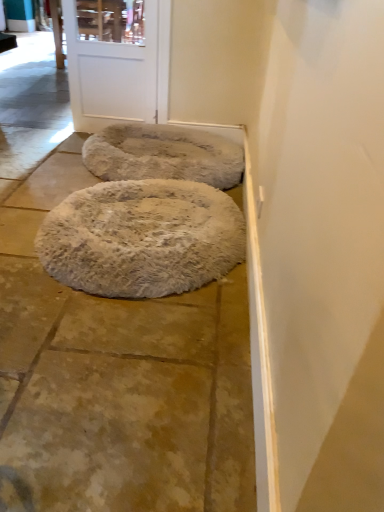
At what (x,y) coordinates should I click in order to perform the action: click on white fluffy rug at center. Please return your answer as a coordinate pair (x, y). The height and width of the screenshot is (512, 384). Looking at the image, I should click on (119, 379).

What is the approximate width of white fluffy rug at center?

It is 8.79 feet.

At what (x,y) coordinates should I click in order to perform the action: click on white fluffy dog bed at center, the second dog bed viewed from the back. Please return your answer as a coordinate pair (x, y). This screenshot has width=384, height=512. Looking at the image, I should click on click(x=142, y=238).

Considering the relative sizes of fuzzy beige dog bed at center, the 2th dog bed positioned from the front, and white fluffy dog bed at center, the second dog bed viewed from the back, in the image provided, is fuzzy beige dog bed at center, the 2th dog bed positioned from the front, thinner than white fluffy dog bed at center, the second dog bed viewed from the back,?

Incorrect, the width of fuzzy beige dog bed at center, the 2th dog bed positioned from the front, is not less than that of white fluffy dog bed at center, the second dog bed viewed from the back.

Which object is further away from the camera taking this photo, fuzzy beige dog bed at center, placed as the 1th dog bed when sorted from back to front, or white fluffy dog bed at center, which appears as the 1th dog bed when viewed from the front?

fuzzy beige dog bed at center, placed as the 1th dog bed when sorted from back to front.

In the image, is fuzzy beige dog bed at center, the 2th dog bed positioned from the front, on the left side or the right side of white fluffy dog bed at center, the second dog bed viewed from the back?

From the image, it's evident that fuzzy beige dog bed at center, the 2th dog bed positioned from the front, is to the right of white fluffy dog bed at center, the second dog bed viewed from the back.

Which of these two, fuzzy beige dog bed at center, the 2th dog bed positioned from the front, or white fluffy dog bed at center, which appears as the 1th dog bed when viewed from the front, is bigger?

Bigger between the two is fuzzy beige dog bed at center, the 2th dog bed positioned from the front.

From the picture: Is fuzzy beige dog bed at center, the 2th dog bed positioned from the front, positioned beyond the bounds of white fluffy rug at center?

Yes, fuzzy beige dog bed at center, the 2th dog bed positioned from the front, is not within white fluffy rug at center.

Is fuzzy beige dog bed at center, placed as the 1th dog bed when sorted from back to front, looking in the opposite direction of white fluffy rug at center?

No, fuzzy beige dog bed at center, placed as the 1th dog bed when sorted from back to front, is not facing the opposite direction of white fluffy rug at center.

Considering the relative sizes of fuzzy beige dog bed at center, the 2th dog bed positioned from the front, and white fluffy rug at center in the image provided, is fuzzy beige dog bed at center, the 2th dog bed positioned from the front, smaller than white fluffy rug at center?

Indeed, fuzzy beige dog bed at center, the 2th dog bed positioned from the front, has a smaller size compared to white fluffy rug at center.

Considering the relative positions of fuzzy beige dog bed at center, placed as the 1th dog bed when sorted from back to front, and white fluffy rug at center in the image provided, is fuzzy beige dog bed at center, placed as the 1th dog bed when sorted from back to front, in front of white fluffy rug at center?

That is False.

Could you tell me if white fluffy rug at center is turned towards white fluffy dog bed at center, the second dog bed viewed from the back?

No, white fluffy rug at center is not facing towards white fluffy dog bed at center, the second dog bed viewed from the back.

Is white fluffy rug at center not close to white fluffy dog bed at center, the second dog bed viewed from the back?

That's not correct — white fluffy rug at center is a little close to white fluffy dog bed at center, the second dog bed viewed from the back.

Is white fluffy rug at center positioned beyond the bounds of white fluffy dog bed at center, which appears as the 1th dog bed when viewed from the front?

Yes.

Between white fluffy rug at center and white fluffy dog bed at center, which appears as the 1th dog bed when viewed from the front, which one has smaller width?

Thinner between the two is white fluffy dog bed at center, which appears as the 1th dog bed when viewed from the front.

Could you measure the distance between white fluffy dog bed at center, which appears as the 1th dog bed when viewed from the front, and white matte door at upper center?

4.20 feet.

Is white fluffy dog bed at center, which appears as the 1th dog bed when viewed from the front, oriented away from white matte door at upper center?

No, white fluffy dog bed at center, which appears as the 1th dog bed when viewed from the front,'s orientation is not away from white matte door at upper center.

Which object is positioned more to the right, white fluffy dog bed at center, the second dog bed viewed from the back, or white matte door at upper center?

white fluffy dog bed at center, the second dog bed viewed from the back.

Is white fluffy dog bed at center, the second dog bed viewed from the back, directly adjacent to white matte door at upper center?

No.

How many degrees apart are the facing directions of white fluffy dog bed at center, the second dog bed viewed from the back, and white fluffy rug at center?

There is a 90.6-degree angle between the facing directions of white fluffy dog bed at center, the second dog bed viewed from the back, and white fluffy rug at center.

Is white fluffy dog bed at center, which appears as the 1th dog bed when viewed from the front, closer to the viewer compared to white fluffy rug at center?

That is False.

Is white fluffy dog bed at center, which appears as the 1th dog bed when viewed from the front, turned away from white fluffy rug at center?

That's not correct — white fluffy dog bed at center, which appears as the 1th dog bed when viewed from the front, is not looking away from white fluffy rug at center.

Is white fluffy dog bed at center, the second dog bed viewed from the back, directly adjacent to white fluffy rug at center?

white fluffy dog bed at center, the second dog bed viewed from the back, and white fluffy rug at center are not in contact.

Is white fluffy rug at center further to camera compared to white matte door at upper center?

No, the depth of white fluffy rug at center is less than that of white matte door at upper center.

Find the location of a particular element. pavement below the white matte door at upper center (from the image's perspective) is located at coordinates (119, 379).

Considering the sizes of objects white fluffy rug at center and white matte door at upper center in the image provided, who is shorter, white fluffy rug at center or white matte door at upper center?

white fluffy rug at center.

In the scene shown: Which object is wider, white fluffy rug at center or white matte door at upper center?

Wider between the two is white fluffy rug at center.

From the image's perspective, is white fluffy rug at center above fuzzy beige dog bed at center, placed as the 1th dog bed when sorted from back to front?

No.

Which is in front, point (177, 316) or point (166, 146)?

The point (177, 316) is in front.

Which of these two, white fluffy rug at center or fuzzy beige dog bed at center, placed as the 1th dog bed when sorted from back to front, is wider?

With larger width is white fluffy rug at center.

This screenshot has width=384, height=512. What are the coordinates of `pavement in front of the fuzzy beige dog bed at center, the 2th dog bed positioned from the front` in the screenshot? It's located at pos(119,379).

What are the coordinates of `dog bed on the left side of fuzzy beige dog bed at center, placed as the 1th dog bed when sorted from back to front` in the screenshot? It's located at tap(142, 238).

From the image's perspective, which dog bed is the 2nd one above the white fluffy rug at center? Please provide its 2D coordinates.

[(163, 155)]

Based on their spatial positions, is white fluffy dog bed at center, which appears as the 1th dog bed when viewed from the front, or white fluffy rug at center further from white matte door at upper center?

The object further to white matte door at upper center is white fluffy rug at center.

Considering their positions, is white fluffy dog bed at center, the second dog bed viewed from the back, positioned closer to white matte door at upper center than fuzzy beige dog bed at center, placed as the 1th dog bed when sorted from back to front?

The object closer to white matte door at upper center is fuzzy beige dog bed at center, placed as the 1th dog bed when sorted from back to front.

Estimate the real-world distances between objects in this image. Which object is closer to white fluffy dog bed at center, the second dog bed viewed from the back, fuzzy beige dog bed at center, placed as the 1th dog bed when sorted from back to front, or white fluffy rug at center?

white fluffy rug at center lies closer to white fluffy dog bed at center, the second dog bed viewed from the back, than the other object.

From the image, which object appears to be farther from fuzzy beige dog bed at center, placed as the 1th dog bed when sorted from back to front, white matte door at upper center or white fluffy rug at center?

Among the two, white fluffy rug at center is located further to fuzzy beige dog bed at center, placed as the 1th dog bed when sorted from back to front.

Estimate the real-world distances between objects in this image. Which object is further from white fluffy rug at center, white matte door at upper center or fuzzy beige dog bed at center, the 2th dog bed positioned from the front?

white matte door at upper center lies further to white fluffy rug at center than the other object.

Estimate the real-world distances between objects in this image. Which object is closer to white fluffy dog bed at center, the second dog bed viewed from the back, fuzzy beige dog bed at center, the 2th dog bed positioned from the front, or white matte door at upper center?

fuzzy beige dog bed at center, the 2th dog bed positioned from the front, is positioned closer to the anchor white fluffy dog bed at center, the second dog bed viewed from the back.

Estimate the real-world distances between objects in this image. Which object is closer to white matte door at upper center, white fluffy rug at center or fuzzy beige dog bed at center, the 2th dog bed positioned from the front?

Based on the image, fuzzy beige dog bed at center, the 2th dog bed positioned from the front, appears to be nearer to white matte door at upper center.

When comparing their distances from white fluffy dog bed at center, the second dog bed viewed from the back, does white fluffy rug at center or fuzzy beige dog bed at center, placed as the 1th dog bed when sorted from back to front, seem further?

fuzzy beige dog bed at center, placed as the 1th dog bed when sorted from back to front, is further to white fluffy dog bed at center, the second dog bed viewed from the back.

The image size is (384, 512). I want to click on dog bed between white fluffy dog bed at center, the second dog bed viewed from the back, and white matte door at upper center in the front-back direction, so click(x=163, y=155).

The width and height of the screenshot is (384, 512). I want to click on dog bed between white fluffy rug at center and fuzzy beige dog bed at center, placed as the 1th dog bed when sorted from back to front, in the front-back direction, so click(x=142, y=238).